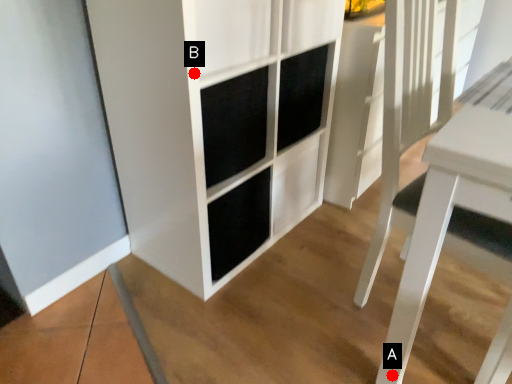
Question: Two points are circled on the image, labeled by A and B beside each circle. Which point is closer to the camera?

Choices:
 (A) A is closer
 (B) B is closer

Answer: (B)